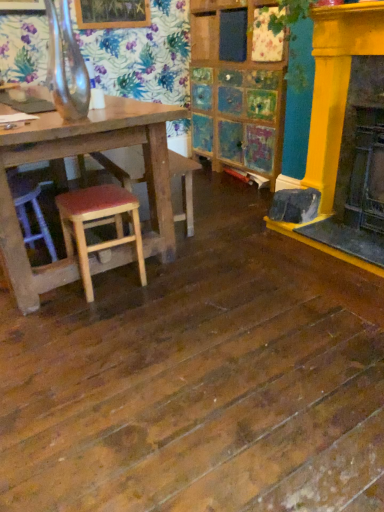
Locate an element on the screen. vacant space situated above wooden stool with red cushion at lower left (from a real-world perspective) is located at coordinates (92, 196).